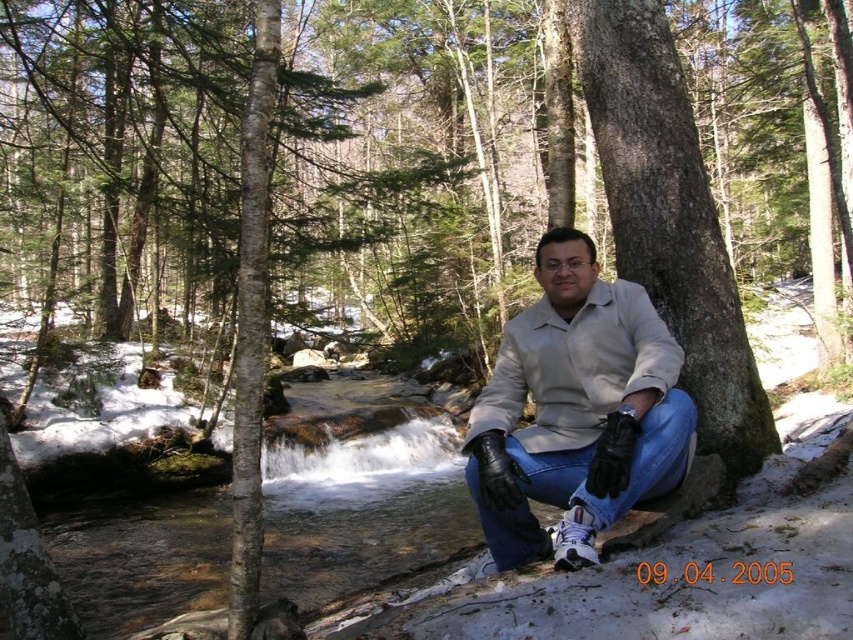
Question: Can you confirm if smooth brown tree trunk at center is thinner than smooth bark tree trunk at left?

Choices:
 (A) no
 (B) yes

Answer: (A)

Question: Can you confirm if beige leather jacket at center is positioned above smooth bark tree trunk at left?

Choices:
 (A) no
 (B) yes

Answer: (A)

Question: Which point appears closest to the camera in this image?

Choices:
 (A) (608, 474)
 (B) (657, 172)

Answer: (A)

Question: Which point is closer to the camera taking this photo?

Choices:
 (A) (241, 476)
 (B) (570, 240)

Answer: (A)

Question: Estimate the real-world distances between objects in this image. Which object is farther from the smooth bark tree trunk at left?

Choices:
 (A) beige leather jacket at center
 (B) smooth brown tree trunk at center

Answer: (B)

Question: Does beige leather jacket at center appear under smooth bark tree trunk at left?

Choices:
 (A) yes
 (B) no

Answer: (A)